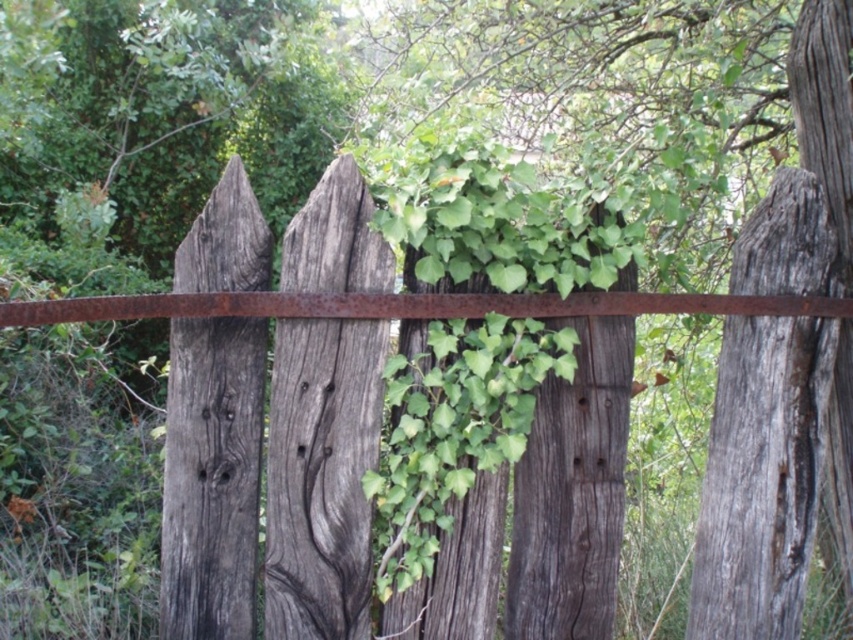
Question: Which point is farther from the camera taking this photo?

Choices:
 (A) (321, 276)
 (B) (194, 260)

Answer: (A)

Question: Which object is farther from the camera taking this photo?

Choices:
 (A) gray weathered wood at center
 (B) weathered gray wood at left

Answer: (A)

Question: Which object is closer to the camera taking this photo?

Choices:
 (A) gray weathered wood at center
 (B) weathered gray wood at left

Answer: (B)

Question: Is gray weathered wood at center in front of weathered gray wood at left?

Choices:
 (A) no
 (B) yes

Answer: (A)

Question: Can you confirm if gray weathered wood at center is thinner than weathered gray wood at left?

Choices:
 (A) yes
 (B) no

Answer: (B)

Question: Considering the relative positions of gray weathered wood at center and weathered gray wood at left in the image provided, where is gray weathered wood at center located with respect to weathered gray wood at left?

Choices:
 (A) below
 (B) above

Answer: (B)